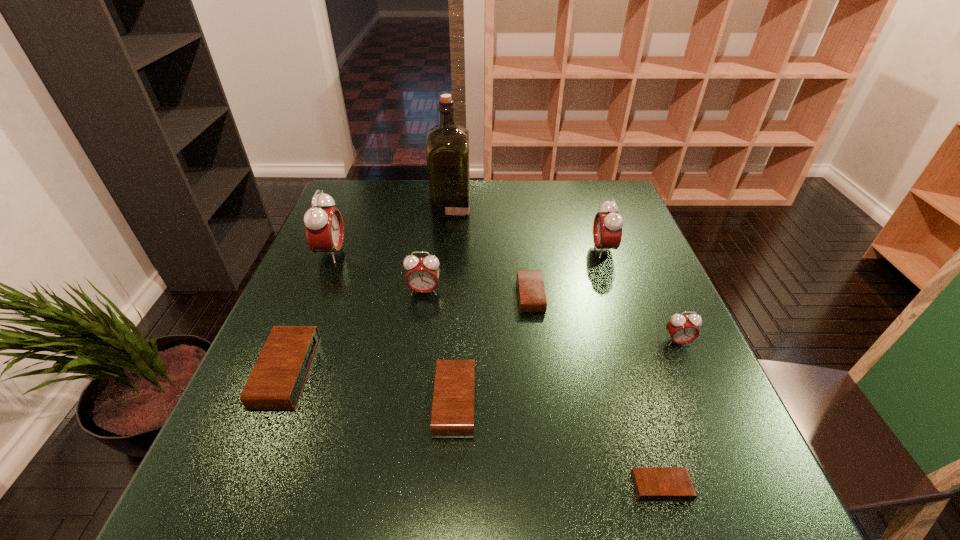
Locate an element on the screen. This screenshot has height=540, width=960. object at the far edge is located at coordinates (447, 146).

Locate an element on the screen. object that is positioned at the near edge is located at coordinates (652, 484).

Where is `object that is at the near right corner`? object that is at the near right corner is located at coordinates (652, 484).

In the image, there is a desktop. At what (x,y) coordinates should I click in order to perform the action: click on vacant space at the far edge. Please return your answer as a coordinate pair (x, y). This screenshot has height=540, width=960. Looking at the image, I should click on (536, 205).

Find the location of `vacant area at the left edge of the desktop`. vacant area at the left edge of the desktop is located at coordinates (365, 255).

The height and width of the screenshot is (540, 960). In the image, there is a desktop. In order to click on vacant space at the right edge in this screenshot , I will do `click(653, 295)`.

Identify the location of blank area at the near right corner. The width and height of the screenshot is (960, 540). (710, 486).

The width and height of the screenshot is (960, 540). Identify the location of free point between the tallest object and the second pink alarm clock from left to right. (438, 248).

I want to click on empty space that is in between the nearest black alarm clock and the third pink alarm clock from left to right, so click(x=632, y=368).

This screenshot has height=540, width=960. In order to click on free area in between the fourth shortest object and the leftmost pink alarm clock in this screenshot , I will do `click(309, 313)`.